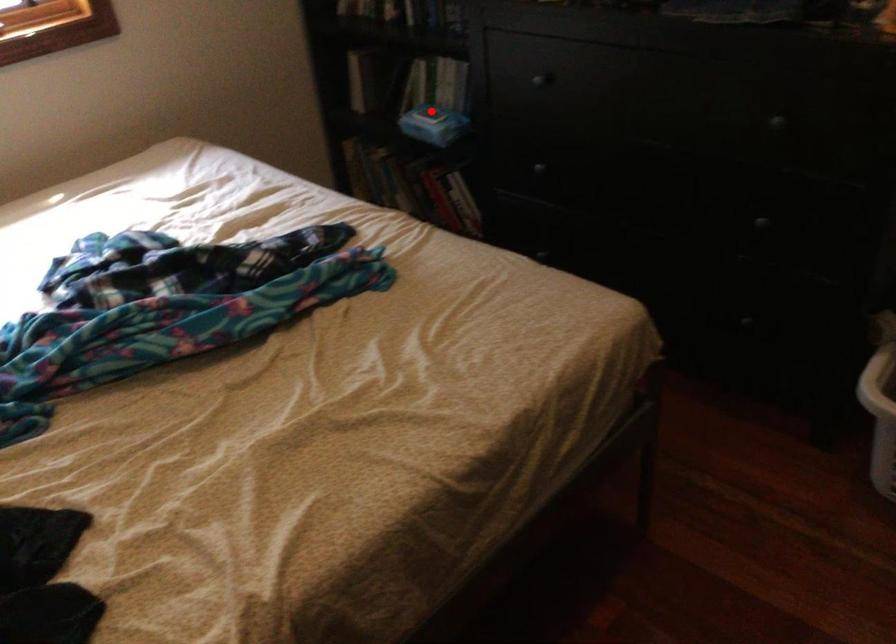
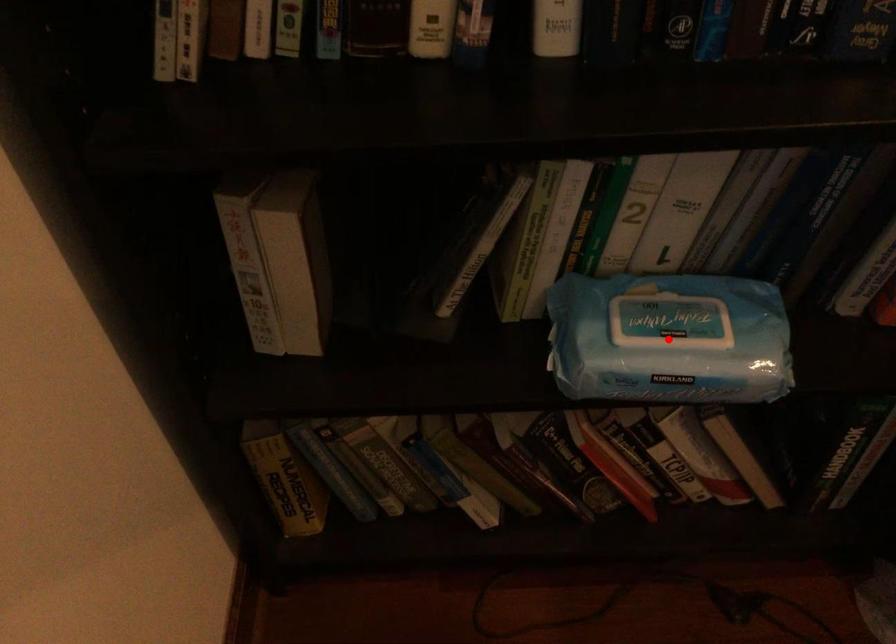
I am providing you with two images of the same scene from different viewpoints. A red point is marked on the first image and another point is marked on the second image. Do the highlighted points in image1 and image2 indicate the same real-world spot?

No